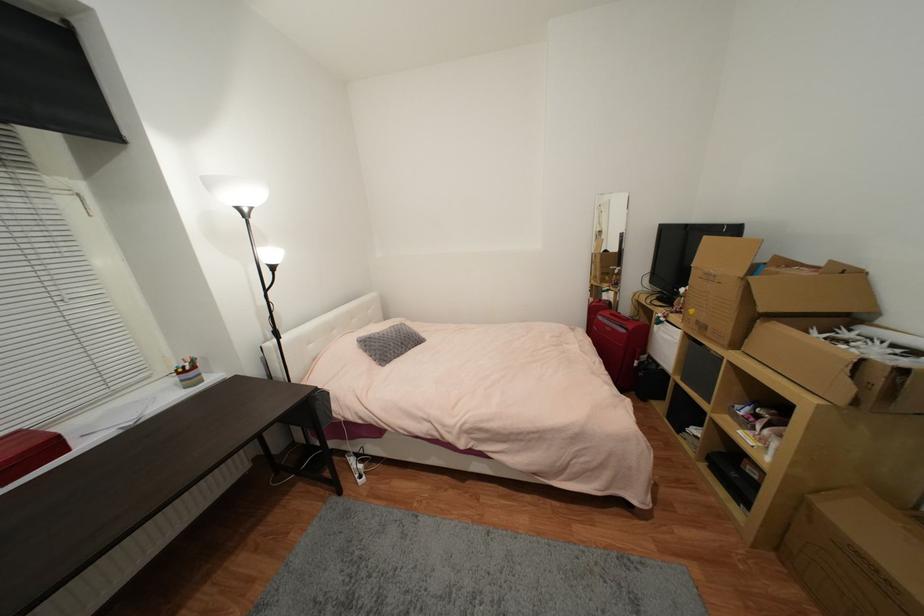
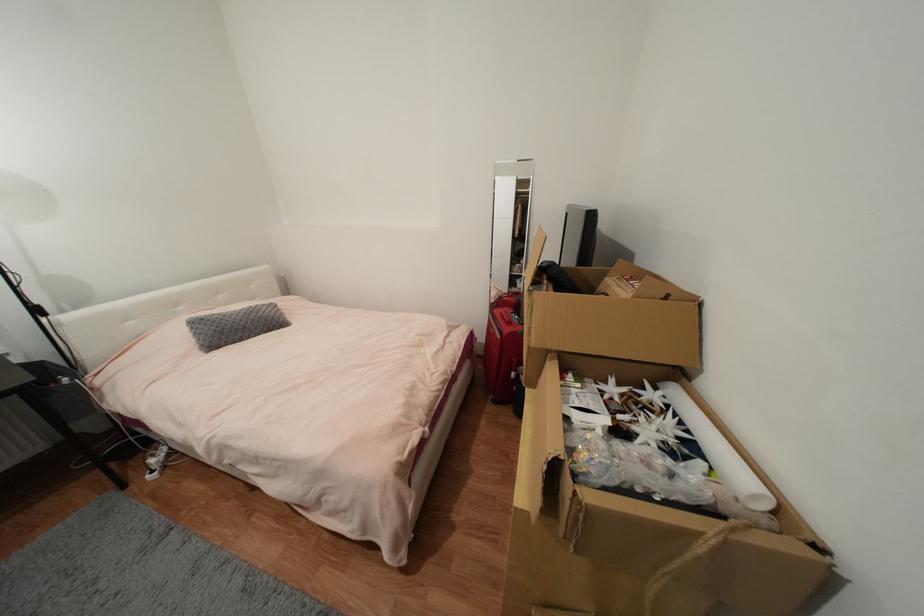
Where in the second image is the point corresponding to the point at 824,334 from the first image?

(624, 386)